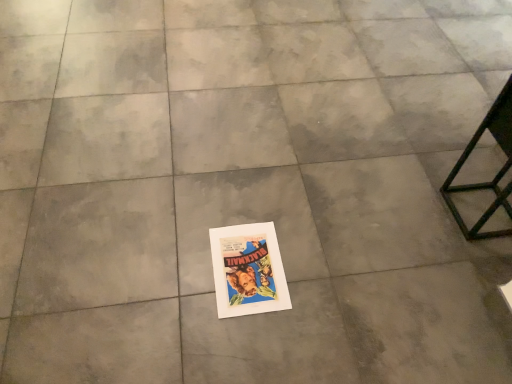
Identify the location of vacant space situated on the left part of metallic black table at right. This screenshot has height=384, width=512. (412, 211).